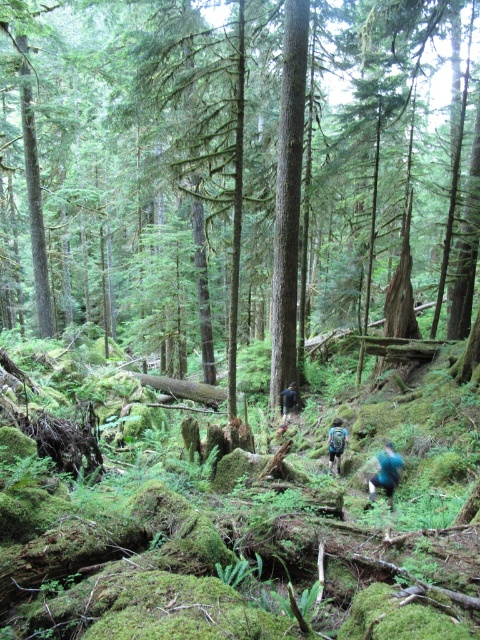
Does green mossy tree at center appear on the left side of dark blue backpack at center?

Indeed, green mossy tree at center is positioned on the left side of dark blue backpack at center.

You are a GUI agent. You are given a task and a screenshot of the screen. Output one action in this format:
    pyautogui.click(x=<x>, y=<y>)
    Task: Click on the green mossy tree at center
    The image size is (480, 640).
    Given the screenshot: What is the action you would take?
    pyautogui.click(x=247, y=145)

At what (x,y) coordinates should I click in order to perform the action: click on green mossy tree at center. Please return your answer as a coordinate pair (x, y). Image resolution: width=480 pixels, height=640 pixels. Looking at the image, I should click on (247, 145).

Is point (337, 419) in front of point (288, 385)?

Yes, it is.

Between point (334, 435) and point (283, 410), which one is positioned in front?

Point (334, 435) is in front.

Who is more forward, (339, 436) or (283, 406)?

Point (339, 436)

Find the location of a particular element. The height and width of the screenshot is (640, 480). blue fabric backpack at center is located at coordinates (336, 442).

Between point (156, 284) and point (393, 486), which one is positioned in front?

Point (393, 486)

Based on the photo, does green mossy tree at center lie in front of teal fabric backpack at lower center?

No, it is not.

The image size is (480, 640). What do you see at coordinates (247, 145) in the screenshot? I see `green mossy tree at center` at bounding box center [247, 145].

The width and height of the screenshot is (480, 640). I want to click on green mossy tree at center, so click(247, 145).